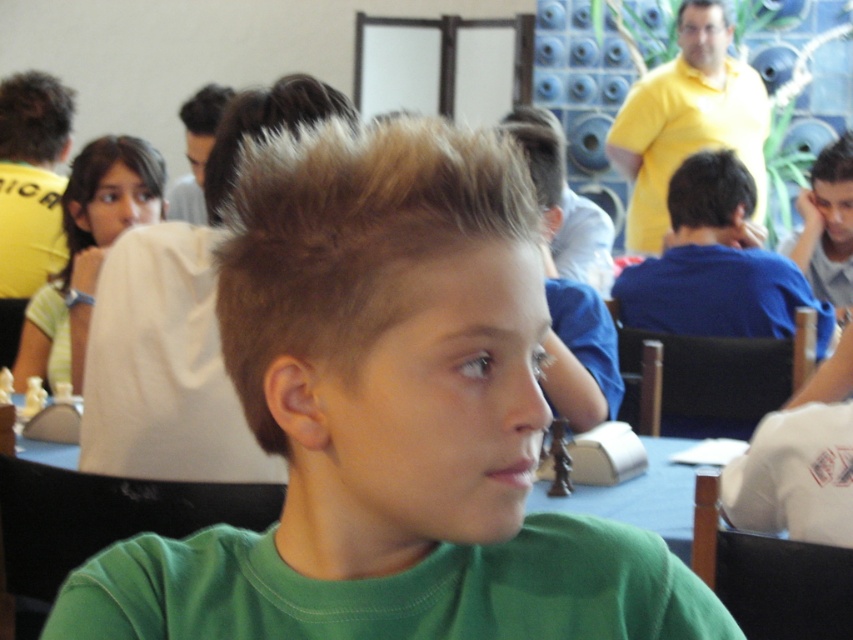
Does green matte shirt at center appear on the right side of slicked-back hair at center?

Incorrect, green matte shirt at center is not on the right side of slicked-back hair at center.

Between point (265, 605) and point (840, 220), which one is positioned in front?

Point (265, 605) is in front.

Is point (311, 621) behind point (844, 314)?

No, (311, 621) is in front of (844, 314).

Identify the location of green matte shirt at center. (389, 419).

Is green matte shirt at center thinner than slicked brown hair at upper right?

Incorrect, green matte shirt at center's width is not less than slicked brown hair at upper right's.

Can you confirm if green matte shirt at center is positioned above slicked brown hair at upper right?

Incorrect, green matte shirt at center is not positioned above slicked brown hair at upper right.

Where is `green matte shirt at center`? Image resolution: width=853 pixels, height=640 pixels. green matte shirt at center is located at coordinates [389, 419].

Who is positioned more to the left, light brown hair at upper left or slicked brown hair at upper right?

Positioned to the left is light brown hair at upper left.

Is point (22, 326) more distant than point (843, 145)?

No, (22, 326) is in front of (843, 145).

What do you see at coordinates (86, 252) in the screenshot? The image size is (853, 640). I see `light brown hair at upper left` at bounding box center [86, 252].

Locate an element on the screen. The height and width of the screenshot is (640, 853). light brown hair at upper left is located at coordinates (86, 252).